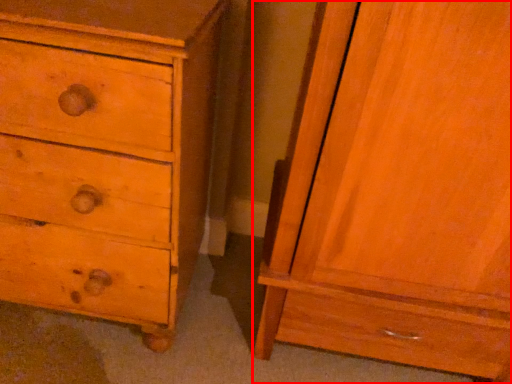
Question: From the image's perspective, where is nightstand (annotated by the red box) located in relation to chest of drawers in the image?

Choices:
 (A) above
 (B) below

Answer: (B)